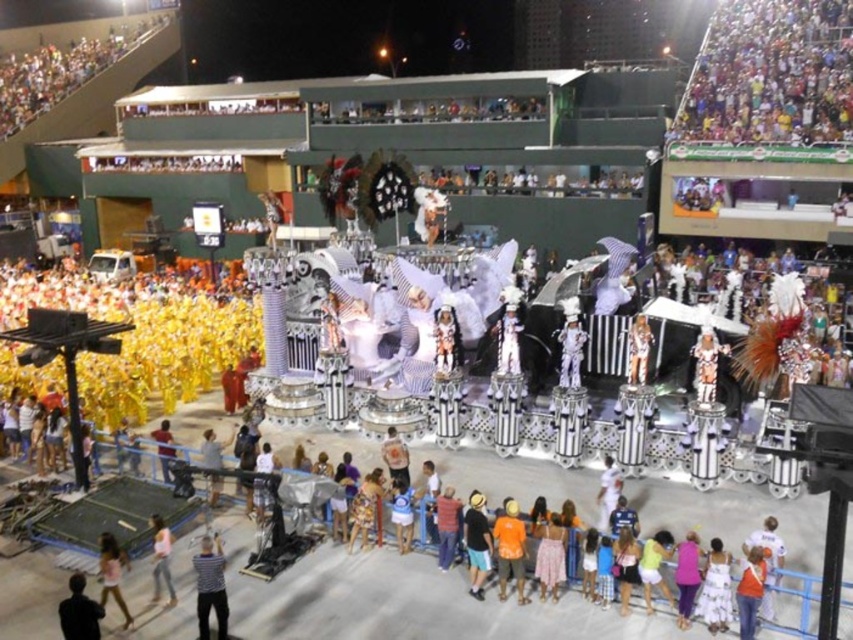
Question: Can you confirm if striped polo shirt at center is positioned above black matte person at lower left?

Choices:
 (A) no
 (B) yes

Answer: (B)

Question: Is multicolored fabric crowd at upper right thinner than orange cotton shirt at center?

Choices:
 (A) yes
 (B) no

Answer: (B)

Question: Which object is farther from the camera taking this photo?

Choices:
 (A) multicolored fabric crowd at upper right
 (B) pink fabric dress at lower center
 (C) striped polo shirt at center

Answer: (A)

Question: Does black matte person at lower left appear over orange fabric person at center?

Choices:
 (A) yes
 (B) no

Answer: (B)

Question: Which object is the farthest from the multicolored fabric crowd at upper right?

Choices:
 (A) light pink fabric dress at lower left
 (B) striped polo shirt at center
 (C) pink fabric dress at lower center

Answer: (A)

Question: Among these objects, which one is farthest from the camera?

Choices:
 (A) pink fabric dress at lower center
 (B) striped polo shirt at center
 (C) black cotton shirt at center

Answer: (C)